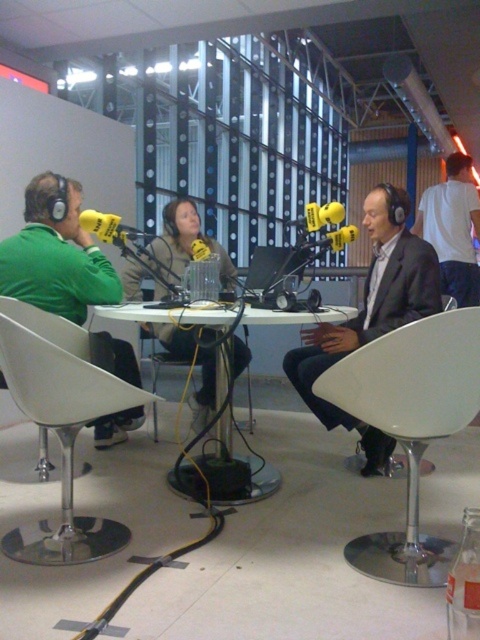
Question: Which of the following is the closest to the observer?

Choices:
 (A) white plastic table at center
 (B) matte black jacket at center
 (C) yellow matte microphone at left

Answer: (A)

Question: Which of the following is the farthest from the observer?

Choices:
 (A) white plastic table at center
 (B) matte black suit at center
 (C) white plastic chair at lower left
 (D) yellow matte microphone at left

Answer: (D)

Question: Where is white plastic table at center located in relation to yellow matte microphone at center in the image?

Choices:
 (A) right
 (B) left

Answer: (B)

Question: Is white plastic chair at lower left positioned in front of matte black jacket at center?

Choices:
 (A) no
 (B) yes

Answer: (B)

Question: Estimate the real-world distances between objects in this image. Which object is farther from the matte black suit at center?

Choices:
 (A) matte black jacket at center
 (B) matte green jacket at left
 (C) white plastic chair at center
 (D) yellow matte microphone at center

Answer: (B)

Question: Is matte green jacket at left smaller than white cotton shirt at right?

Choices:
 (A) no
 (B) yes

Answer: (A)